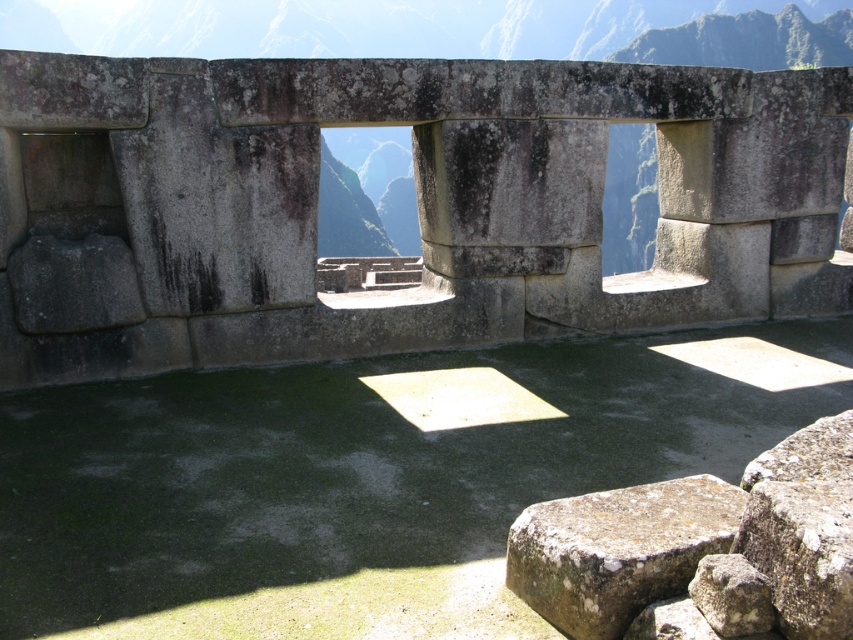
Question: Does gray stone wall at center appear over rusty stone at lower right?

Choices:
 (A) no
 (B) yes

Answer: (B)

Question: From the image, what is the correct spatial relationship of gray stone wall at center in relation to rusty stone at lower right?

Choices:
 (A) left
 (B) right

Answer: (A)

Question: Can you confirm if gray stone wall at center is wider than rusty stone at lower right?

Choices:
 (A) no
 (B) yes

Answer: (B)

Question: Which point is closer to the camera?

Choices:
 (A) (688, 564)
 (B) (708, 32)

Answer: (A)